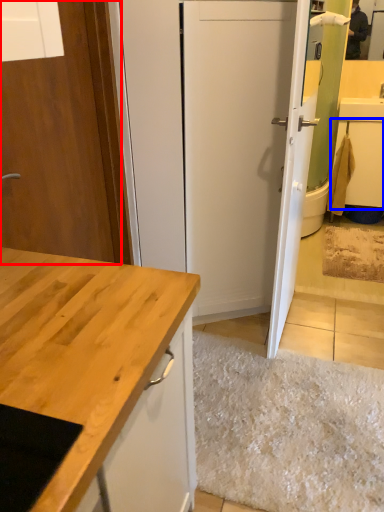
Question: Which object appears farthest to the camera in this image, door (highlighted by a red box) or cabinetry (highlighted by a blue box)?

Choices:
 (A) door
 (B) cabinetry

Answer: (B)